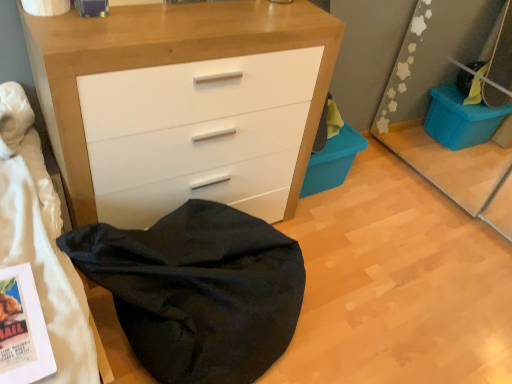
Question: Would you consider black fabric bean bag at lower left to be distant from matte white chest of drawers at center?

Choices:
 (A) no
 (B) yes

Answer: (A)

Question: Is black fabric bean bag at lower left outside matte white chest of drawers at center?

Choices:
 (A) yes
 (B) no

Answer: (A)

Question: From a real-world perspective, is black fabric bean bag at lower left on matte white chest of drawers at center?

Choices:
 (A) no
 (B) yes

Answer: (A)

Question: Considering the relative sizes of black fabric bean bag at lower left and matte white chest of drawers at center in the image provided, is black fabric bean bag at lower left shorter than matte white chest of drawers at center?

Choices:
 (A) yes
 (B) no

Answer: (A)

Question: Can you confirm if black fabric bean bag at lower left is wider than matte white chest of drawers at center?

Choices:
 (A) no
 (B) yes

Answer: (B)

Question: In terms of size, does blue plastic storage bin at lower right appear bigger or smaller than matte white chest of drawers at center?

Choices:
 (A) small
 (B) big

Answer: (A)

Question: From the image's perspective, relative to matte white chest of drawers at center, is blue plastic storage bin at lower right above or below?

Choices:
 (A) below
 (B) above

Answer: (A)

Question: Is blue plastic storage bin at lower right to the left or to the right of matte white chest of drawers at center in the image?

Choices:
 (A) right
 (B) left

Answer: (A)

Question: In the image, is blue plastic storage bin at lower right positioned in front of or behind matte white chest of drawers at center?

Choices:
 (A) front
 (B) behind

Answer: (B)

Question: In the image, is matte white chest of drawers at center positioned in front of or behind black fabric bean bag at lower left?

Choices:
 (A) front
 (B) behind

Answer: (B)

Question: Based on their sizes in the image, would you say matte white chest of drawers at center is bigger or smaller than black fabric bean bag at lower left?

Choices:
 (A) big
 (B) small

Answer: (A)

Question: Considering the positions of matte white chest of drawers at center and black fabric bean bag at lower left in the image, is matte white chest of drawers at center wider or thinner than black fabric bean bag at lower left?

Choices:
 (A) thin
 (B) wide

Answer: (A)

Question: From a real-world perspective, relative to black fabric bean bag at lower left, is matte white chest of drawers at center vertically above or below?

Choices:
 (A) below
 (B) above

Answer: (B)

Question: From the image's perspective, relative to black fabric bean bag at lower left, is blue plastic storage bin at lower right above or below?

Choices:
 (A) above
 (B) below

Answer: (A)

Question: Is blue plastic storage bin at lower right situated inside black fabric bean bag at lower left or outside?

Choices:
 (A) outside
 (B) inside

Answer: (A)